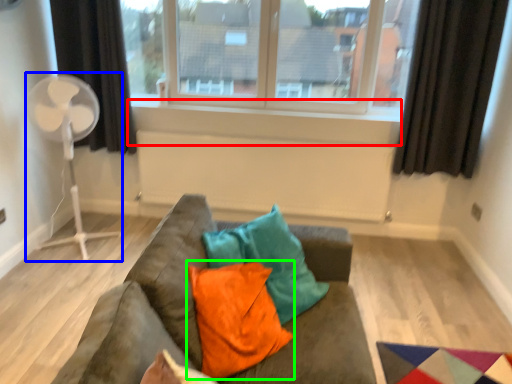
Question: Which object is the farthest from window sill (highlighted by a red box)? Choose among these: fan (highlighted by a blue box) or pillow (highlighted by a green box).

Choices:
 (A) fan
 (B) pillow

Answer: (B)